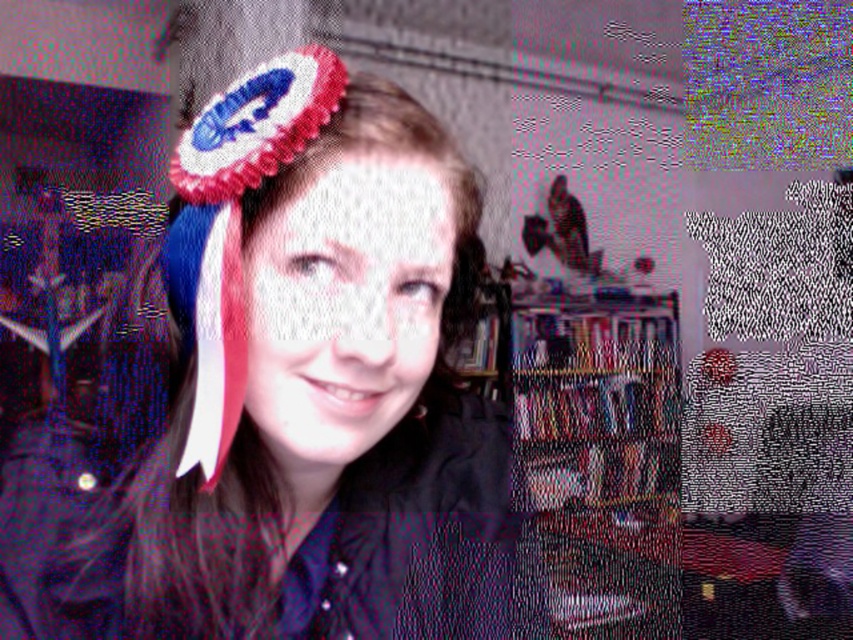
You are trying to decide which headband to wear for an event. You see a fuzzy fabric headband at upper center and a matte fabric headband at center. Which one is positioned to the left of the other?

The fuzzy fabric headband at upper center is to the left of the matte fabric headband at center.

You are a photographer adjusting your camera settings for a closeup shot of a person wearing a fuzzy fabric headband at upper center. The camera has a focus point at point (318, 385). Will the camera focus on the fuzzy fabric headband at upper center?

Yes, the camera will focus on the fuzzy fabric headband at upper center because the focus point at point (318, 385) is exactly where the fuzzy fabric headband at upper center is located.

You are taking a selfie and want to position your phone so that the point at coordinates point (202, 508) and point (335, 406) are both visible in the frame. Based on their positions, which point should be closer to the bottom of the photo?

Point (335, 406) is closer to the bottom of the photo because it has a higher y coordinate than point (202, 508). In image coordinates, higher y values correspond to lower positions on the screen.